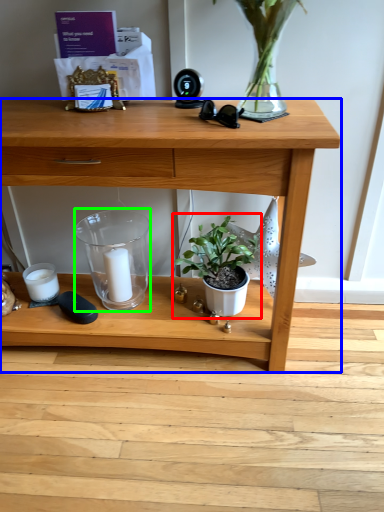
Question: Based on their relative distances, which object is farther from houseplant (highlighted by a red box)? Choose from desk (highlighted by a blue box) and glass vase (highlighted by a green box).

Choices:
 (A) desk
 (B) glass vase

Answer: (B)